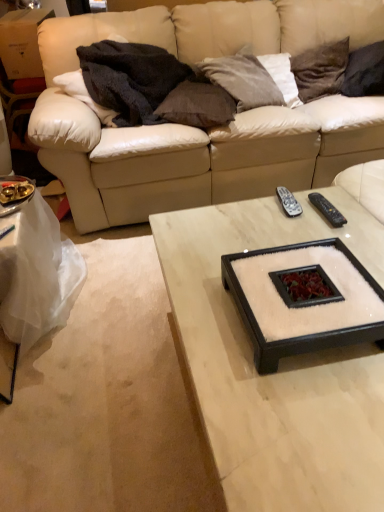
I want to click on vacant space behind black plastic remote control at right, marked as the first remote control in a right-to-left arrangement, so click(322, 197).